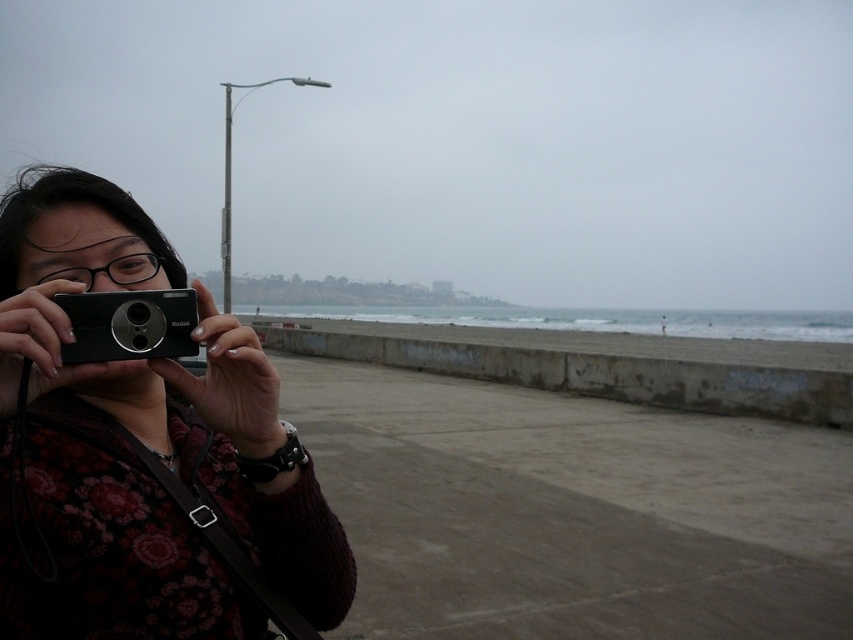
You are a photographer trying to decide which camera to use for a portrait shoot. You have two cameras available in the scene, the matte black camera at left and the black plastic camera at left. Based on their sizes, which one would you choose if you prefer a larger camera for better grip?

The matte black camera at left is much taller than the black plastic camera at left, so you should choose the matte black camera at left for better grip due to its larger size.

You are a photographer trying to set up your equipment on the promenade. You have two cameras, the matte black camera at left and the black plastic camera at left. If you want to place both cameras on the concrete barrier so that one is above the other, which camera should you position higher?

The matte black camera at left should be positioned higher since it is located above the black plastic camera at left in the original image.

From the picture: You are standing at the point marked by the coordinates point (140, 444). Looking towards the ocean, which direction should you turn to face the streetlamp on the left side of the frame?

The point (140, 444) corresponds to the matte black camera at left. Since the streetlamp is on the left side of the frame, facing the ocean would mean turning to your right to face the streetlamp on the left side of the frame.